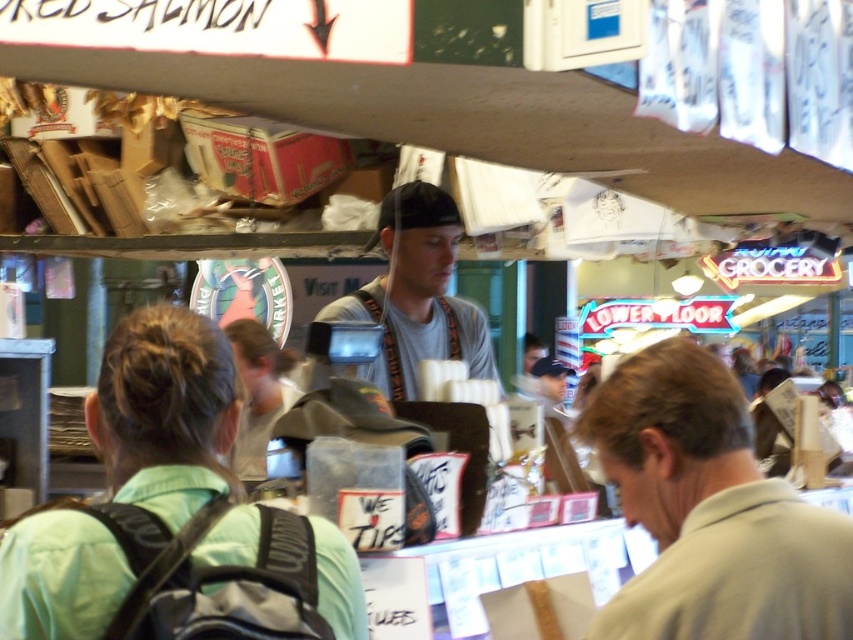
Question: Does gray cotton shirt at center appear on the right side of gray fabric shirt at center?

Choices:
 (A) yes
 (B) no

Answer: (A)

Question: Which point is farther to the camera?

Choices:
 (A) gray fabric shirt at center
 (B) gray fabric cap at center
 (C) green fabric backpack at lower left
 (D) gray cotton shirt at center

Answer: (B)

Question: Which point appears closest to the camera in this image?

Choices:
 (A) (283, 385)
 (B) (741, 536)
 (C) (323, 308)

Answer: (B)

Question: Can you confirm if green fabric backpack at lower left is positioned below gray fabric shirt at center?

Choices:
 (A) no
 (B) yes

Answer: (B)

Question: Is gray cotton shirt at center to the right of green fabric backpack at lower left from the viewer's perspective?

Choices:
 (A) no
 (B) yes

Answer: (B)

Question: Which point appears closest to the camera in this image?

Choices:
 (A) (379, 289)
 (B) (590, 637)
 (C) (202, 388)
 (D) (256, 365)

Answer: (B)